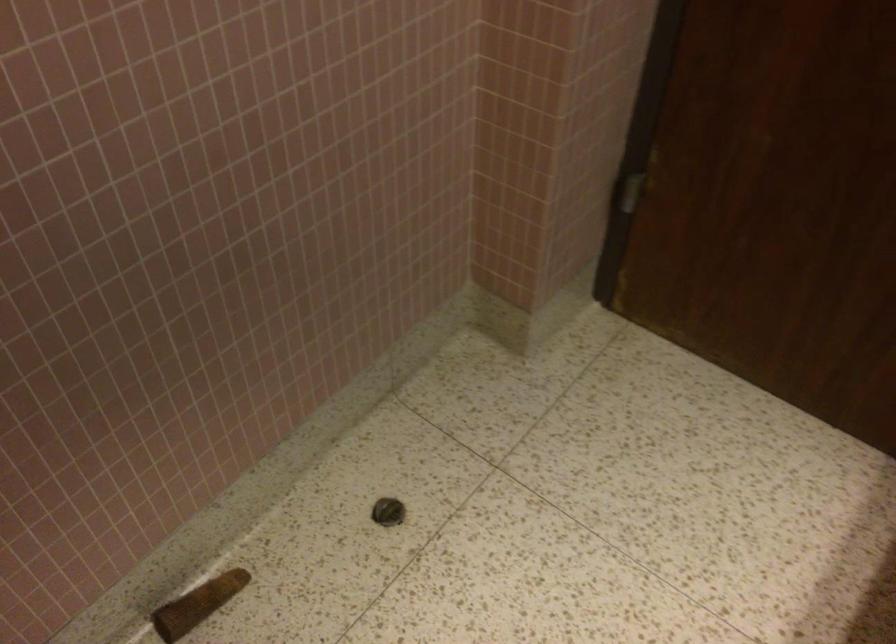
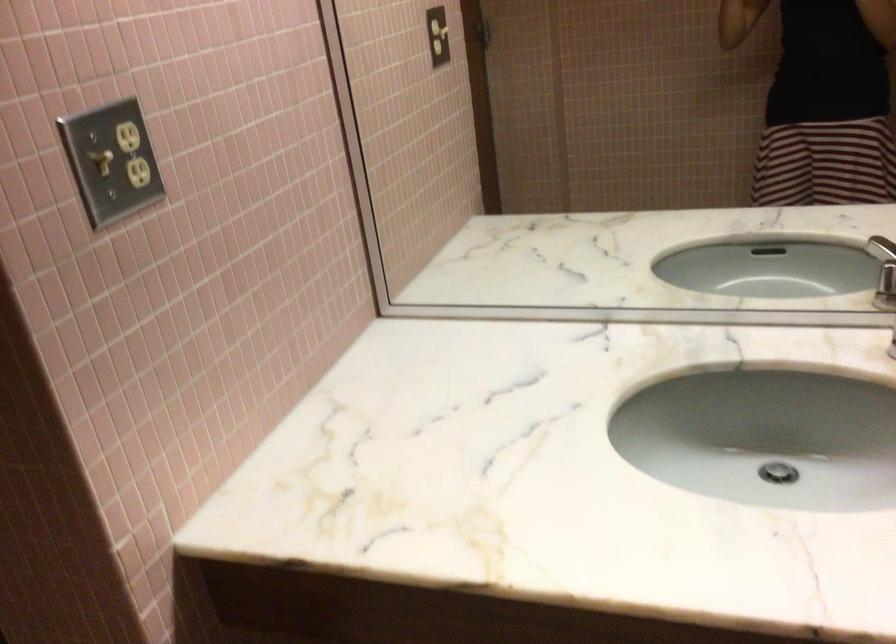
How did the camera likely rotate?

The camera rotated toward right-down.